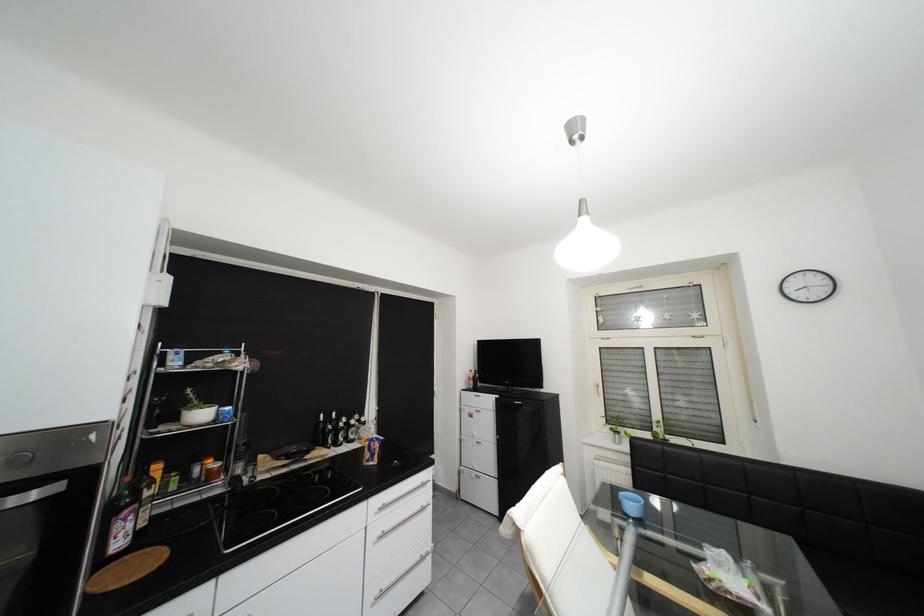
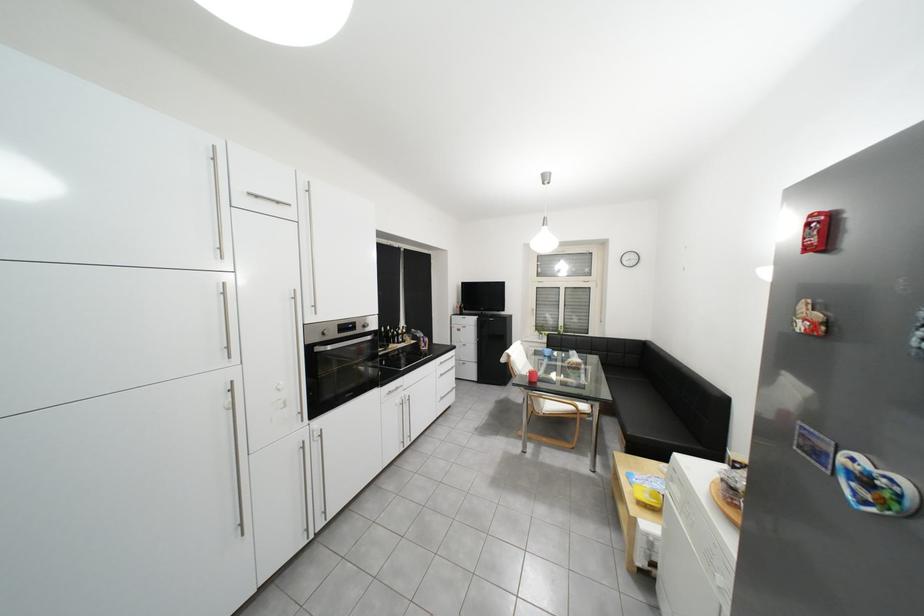
In a continuous first-person perspective shot, in which direction is the camera moving?

The cameraman moved toward left, backward.